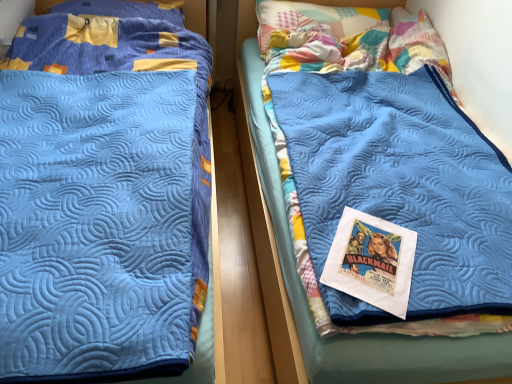
Question: Which direction should I rotate to look at patchwork fabric pillow at upper center, the 1th pillow positioned from the right?

Choices:
 (A) left
 (B) right

Answer: (B)

Question: Is blue quilted blanket at left, marked as the 1th bed in a left-to-right arrangement, shorter than yellow fabric pillow at upper left, which is the second pillow from right to left?

Choices:
 (A) yes
 (B) no

Answer: (B)

Question: Can you confirm if blue quilted blanket at left, acting as the second bed starting from the right, is bigger than yellow fabric pillow at upper left, which ranks as the 1th pillow in left-to-right order?

Choices:
 (A) yes
 (B) no

Answer: (A)

Question: Does blue quilted blanket at left, marked as the 1th bed in a left-to-right arrangement, lie in front of yellow fabric pillow at upper left, which is the second pillow from right to left?

Choices:
 (A) no
 (B) yes

Answer: (B)

Question: Could yellow fabric pillow at upper left, which is the second pillow from right to left, be considered to be inside blue quilted blanket at left, marked as the 1th bed in a left-to-right arrangement?

Choices:
 (A) no
 (B) yes

Answer: (B)

Question: Does blue quilted blanket at left, marked as the 1th bed in a left-to-right arrangement, have a lesser width compared to yellow fabric pillow at upper left, which is the second pillow from right to left?

Choices:
 (A) no
 (B) yes

Answer: (A)

Question: From a real-world perspective, is blue quilted blanket at left, acting as the second bed starting from the right, beneath yellow fabric pillow at upper left, which is the second pillow from right to left?

Choices:
 (A) no
 (B) yes

Answer: (B)

Question: Can we say patchwork fabric pillow at upper center, the 1th pillow positioned from the right, lies outside blue quilted blanket at center, which ranks as the 1th bed in right-to-left order?

Choices:
 (A) no
 (B) yes

Answer: (A)

Question: Is patchwork fabric pillow at upper center, the 2th pillow when ordered from left to right, further to the viewer compared to blue quilted blanket at center, which ranks as the 1th bed in right-to-left order?

Choices:
 (A) no
 (B) yes

Answer: (B)

Question: Is patchwork fabric pillow at upper center, the 2th pillow when ordered from left to right, to the right of blue quilted blanket at center, which ranks as the 1th bed in right-to-left order, from the viewer's perspective?

Choices:
 (A) yes
 (B) no

Answer: (B)

Question: Can you confirm if patchwork fabric pillow at upper center, the 1th pillow positioned from the right, is taller than blue quilted blanket at center, which ranks as the 1th bed in right-to-left order?

Choices:
 (A) no
 (B) yes

Answer: (A)

Question: Are patchwork fabric pillow at upper center, the 1th pillow positioned from the right, and blue quilted blanket at center, the second bed positioned from the left, far apart?

Choices:
 (A) no
 (B) yes

Answer: (A)

Question: Does patchwork fabric pillow at upper center, the 1th pillow positioned from the right, have a smaller size compared to blue quilted blanket at center, the second bed positioned from the left?

Choices:
 (A) yes
 (B) no

Answer: (A)

Question: From the image's perspective, is yellow fabric pillow at upper left, which ranks as the 1th pillow in left-to-right order, below patchwork fabric pillow at upper center, the 2th pillow when ordered from left to right?

Choices:
 (A) yes
 (B) no

Answer: (B)